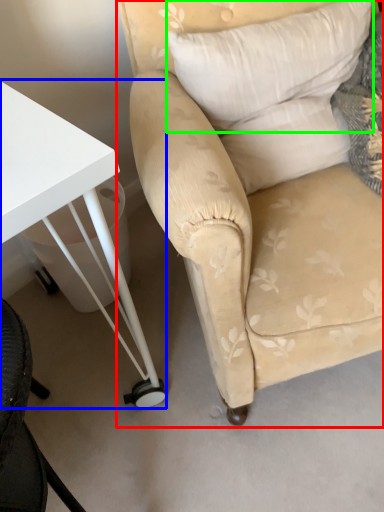
Question: Estimate the real-world distances between objects in this image. Which object is farther from chair (highlighted by a red box), table (highlighted by a blue box) or pillow (highlighted by a green box)?

Choices:
 (A) table
 (B) pillow

Answer: (A)